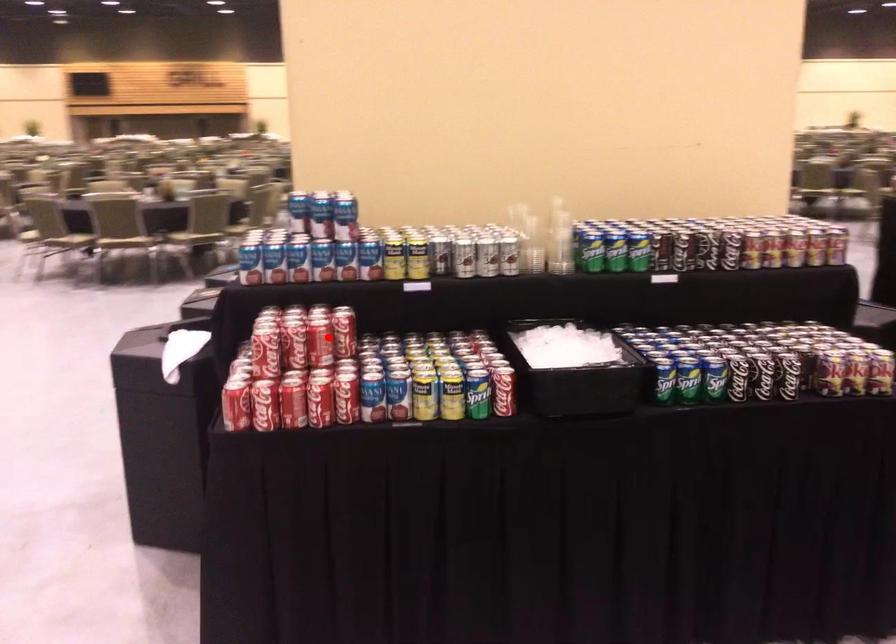
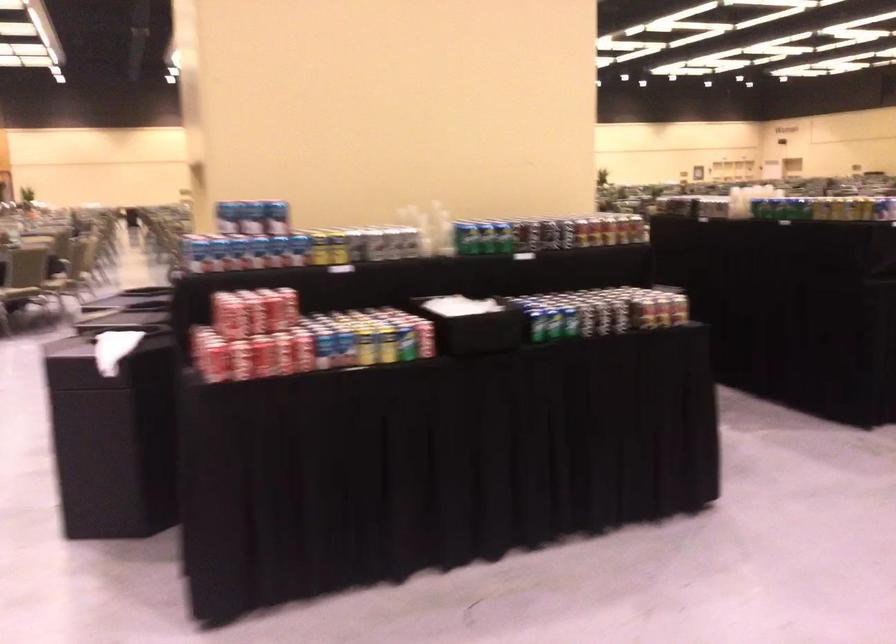
Question: I am providing you with two images of the same scene from different viewpoints. Image1 has a red point marked. In image2, the corresponding 3D location appears at what relative position? Reply with the corresponding letter.

Choices:
 (A) Closer
 (B) Farther

Answer: (B)